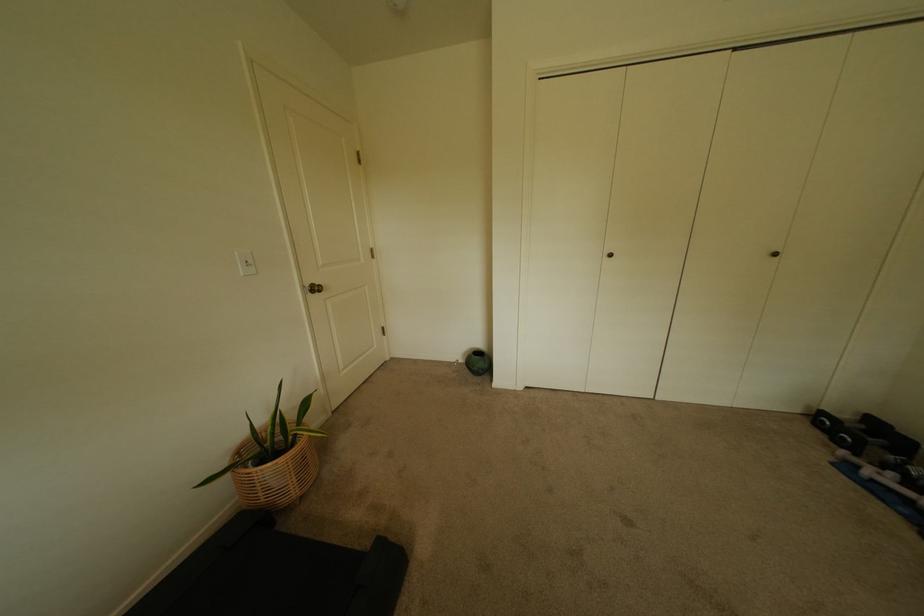
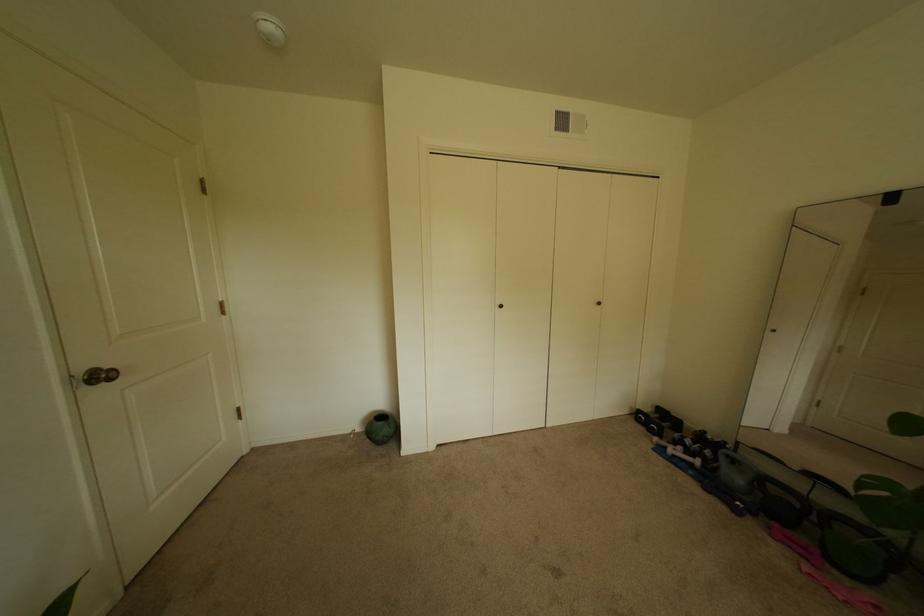
What movement of the cameraman would produce the second image?

The cameraman walked toward left, forward.